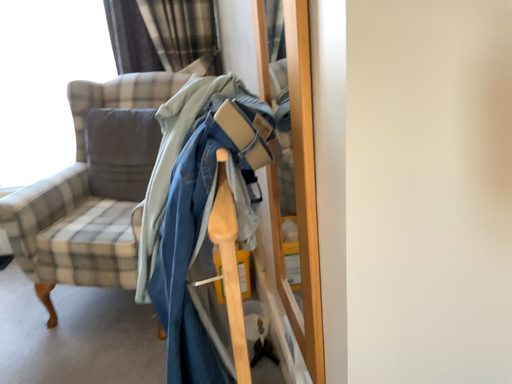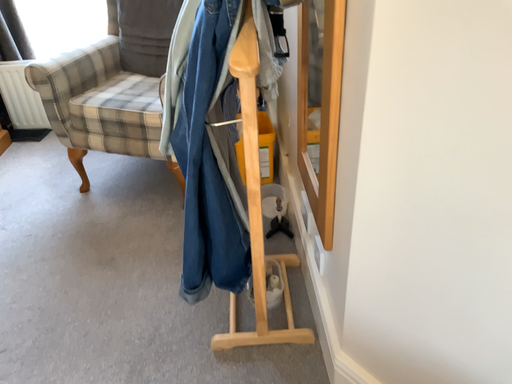
Question: Which way did the camera rotate in the video?

Choices:
 (A) rotated downward
 (B) rotated upward

Answer: (A)